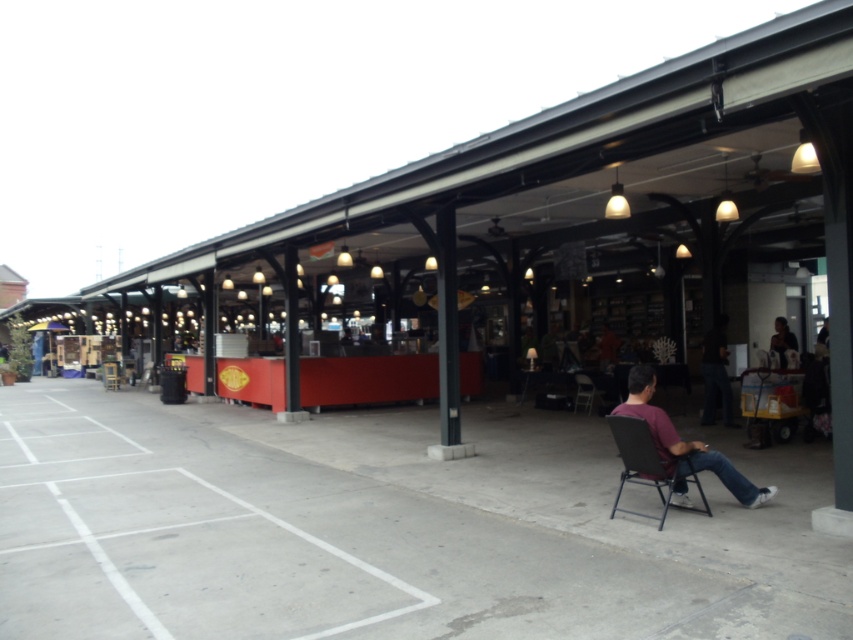
Which is in front, point (741, 490) or point (675, 506)?

Point (741, 490)

Is dark brown fabric chair at lower right thinner than metallic gray folding chair at lower right?

No.

Who is more forward, (686, 488) or (660, 472)?

Point (660, 472) is in front.

This screenshot has width=853, height=640. What are the coordinates of `dark brown fabric chair at lower right` in the screenshot? It's located at (683, 442).

Does metallic gray folding chair at lower right appear on the right side of matte black chair at center?

No, metallic gray folding chair at lower right is not to the right of matte black chair at center.

Is metallic gray folding chair at lower right below matte black chair at center?

Yes.

Identify the location of metallic gray folding chair at lower right. (640, 461).

Is dark blue jeans at center-right taller than matte black chair at center?

Yes.

Is dark blue jeans at center-right to the left of matte black chair at center from the viewer's perspective?

In fact, dark blue jeans at center-right is to the right of matte black chair at center.

Where is `dark blue jeans at center-right`? The image size is (853, 640). dark blue jeans at center-right is located at coordinates (717, 372).